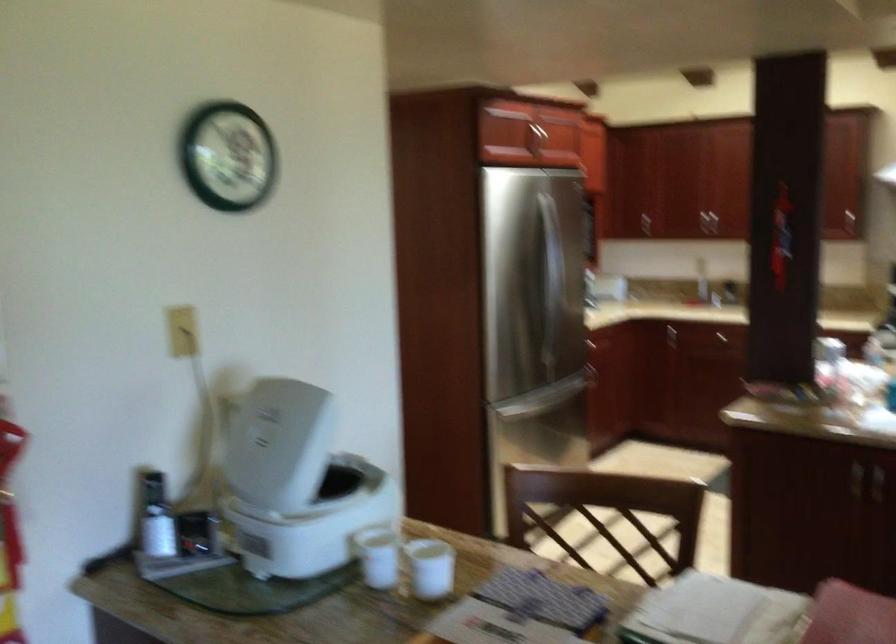
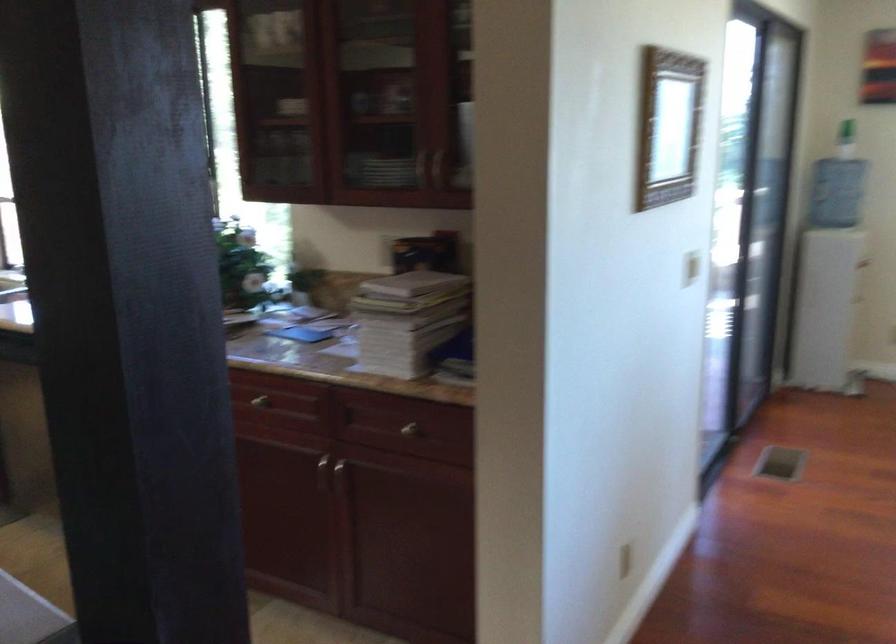
Question: How did the camera likely rotate?

Choices:
 (A) Left
 (B) Right
 (C) Up
 (D) Down

Answer: (B)